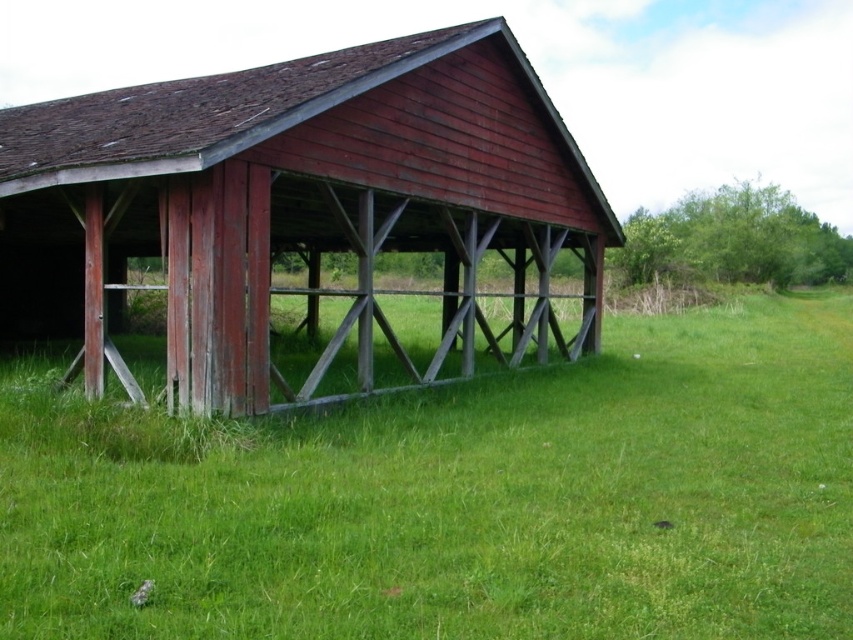
Question: Is green grass at lower left wider than matte wood barn at center?

Choices:
 (A) no
 (B) yes

Answer: (A)

Question: Can you confirm if green grass at lower left is positioned above matte wood barn at center?

Choices:
 (A) yes
 (B) no

Answer: (B)

Question: Which point is closer to the camera?

Choices:
 (A) (416, 561)
 (B) (398, 358)

Answer: (A)

Question: Which point is farther to the camera?

Choices:
 (A) (509, 326)
 (B) (474, 620)

Answer: (A)

Question: Which point is closer to the camera taking this photo?

Choices:
 (A) (483, 234)
 (B) (846, 634)

Answer: (B)

Question: Does green grass at lower left lie behind matte wood barn at center?

Choices:
 (A) no
 (B) yes

Answer: (A)